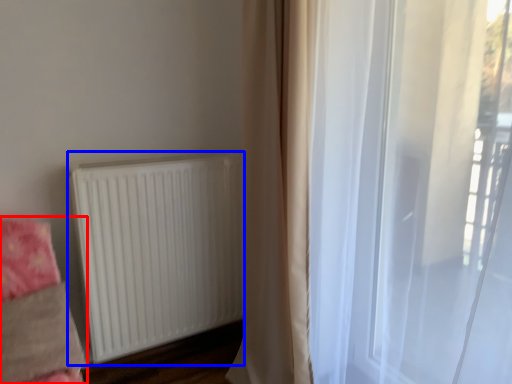
Question: Which point is closer to the camera, bedding (highlighted by a red box) or radiator (highlighted by a blue box)?

Choices:
 (A) bedding
 (B) radiator

Answer: (A)